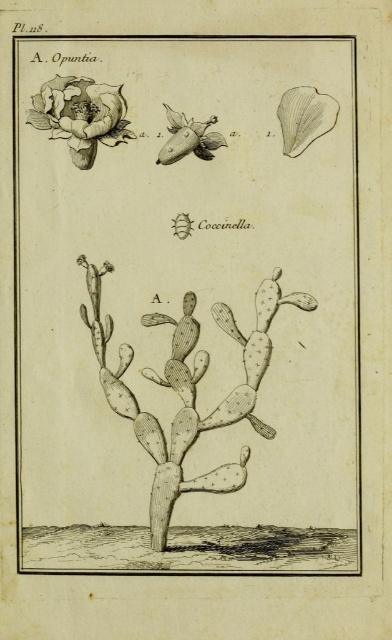
Question: Estimate the real-world distances between objects in this image. Which object is farther from the grayish-brown cactus at center?

Choices:
 (A) grayish-brown spiny cactus at center
 (B) matte white flower at center
 (C) smooth white flower at upper left

Answer: (B)

Question: Which object is positioned closest to the grayish-brown cactus at center?

Choices:
 (A) grayish-brown spiny cactus at center
 (B) matte white flower at center

Answer: (A)

Question: In this image, where is grayish-brown spiny cactus at center located relative to smooth white flower at upper left?

Choices:
 (A) above
 (B) below

Answer: (B)

Question: Does grayish-brown cactus at center have a smaller size compared to matte white flower at center?

Choices:
 (A) yes
 (B) no

Answer: (B)

Question: Where is grayish-brown spiny cactus at center located in relation to matte white flower at center in the image?

Choices:
 (A) left
 (B) right

Answer: (A)

Question: Which object is closer to the camera taking this photo?

Choices:
 (A) grayish-brown cactus at center
 (B) smooth white flower at upper left
 (C) matte white flower at center
 (D) grayish-brown spiny cactus at center

Answer: (D)